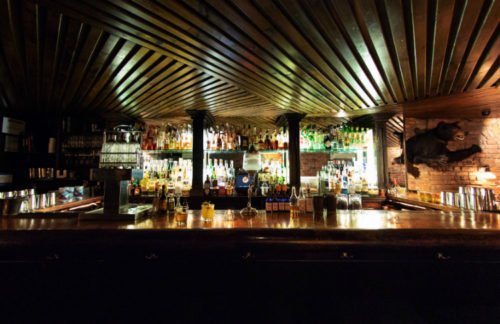
I want to click on counter, so click(379, 233).